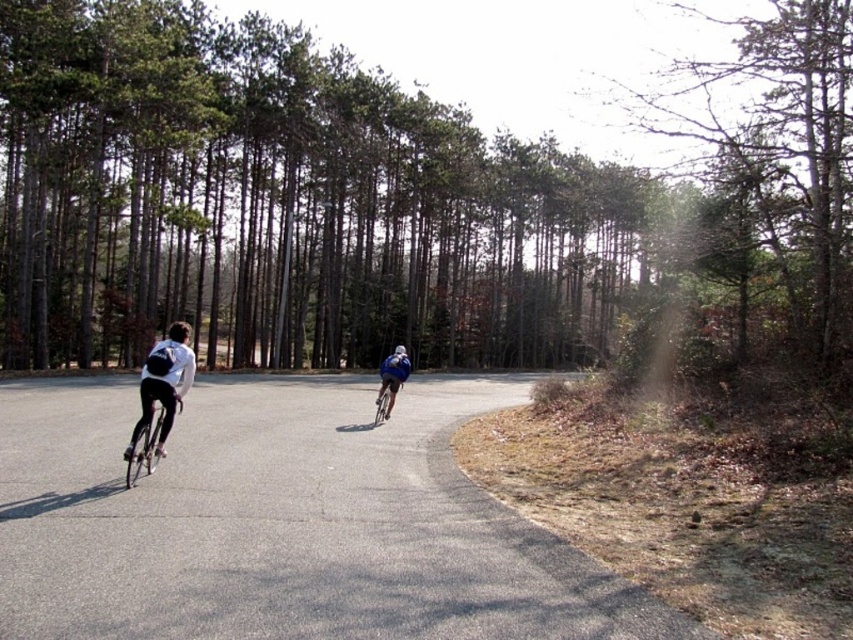
Question: Can you confirm if gray asphalt road at center is thinner than blue matte jacket at center?

Choices:
 (A) no
 (B) yes

Answer: (A)

Question: Among these objects, which one is farthest from the camera?

Choices:
 (A) blue matte helmet at center
 (B) shiny metallic bicycle at left
 (C) blue matte jacket at center

Answer: (A)

Question: Is gray asphalt road at center below blue matte jacket at center?

Choices:
 (A) yes
 (B) no

Answer: (A)

Question: Estimate the real-world distances between objects in this image. Which object is farther from the matte black bicycle at left?

Choices:
 (A) green leafy trees at center
 (B) shiny metallic bicycle at left

Answer: (A)

Question: Does green leafy trees at center lie behind blue matte jacket at center?

Choices:
 (A) no
 (B) yes

Answer: (A)

Question: Which point is farther from the camera taking this photo?

Choices:
 (A) (402, 358)
 (B) (166, 364)
 (C) (395, 355)
 (D) (392, 396)

Answer: (C)